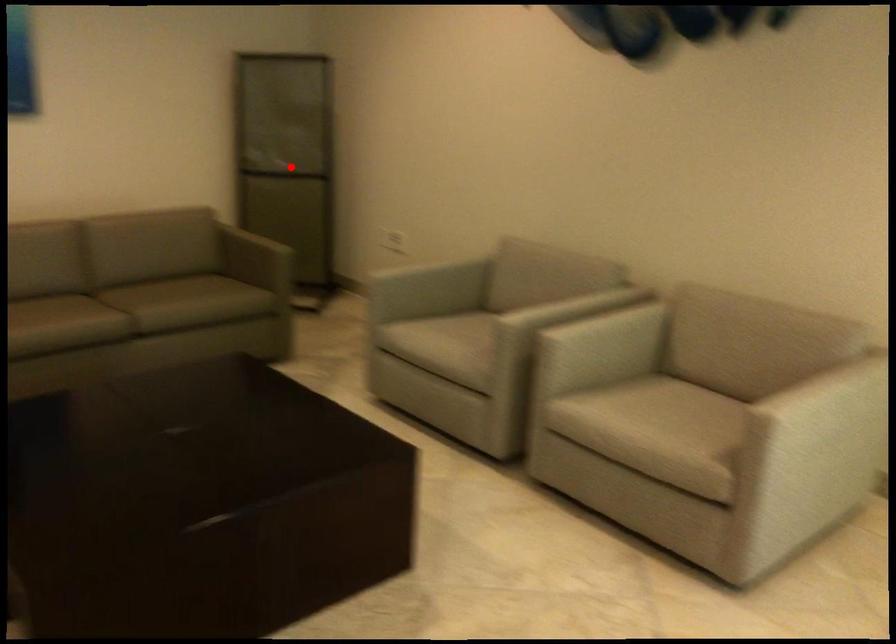
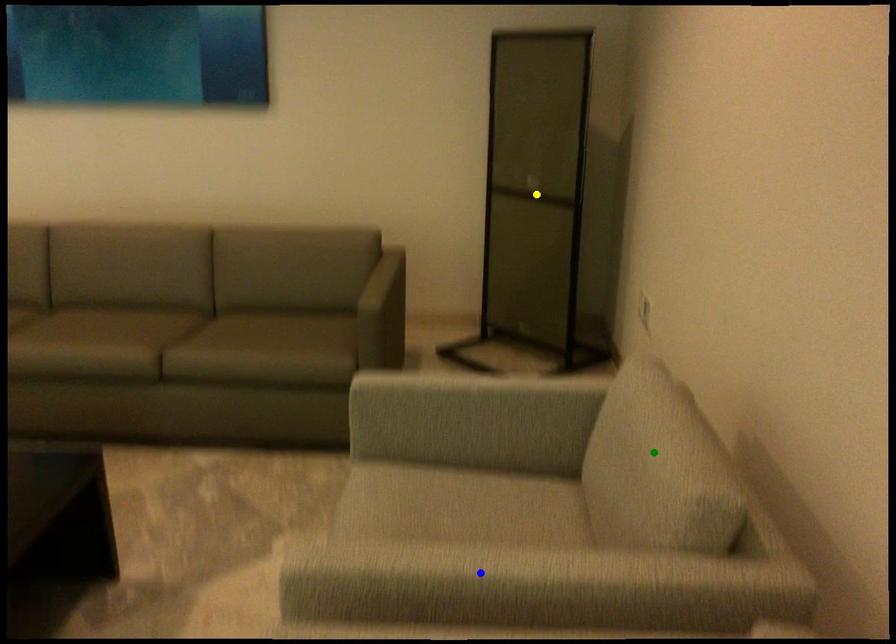
Question: I am providing you with two images of the same scene from different viewpoints. A red point is marked on the first image. You are given multiple points on the second image. Which spot in image 2 lines up with the point in image 1?

Choices:
 (A) blue point
 (B) yellow point
 (C) green point

Answer: (B)